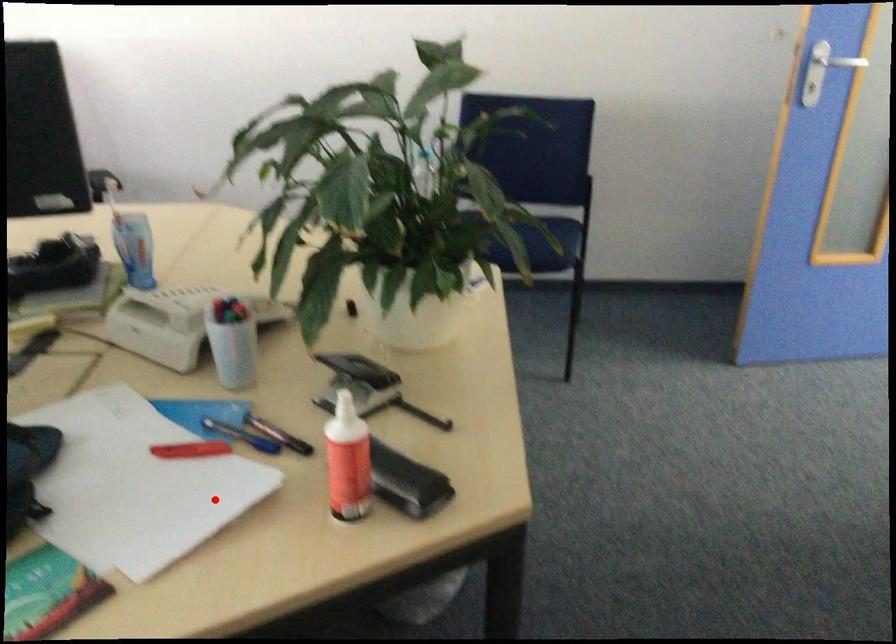
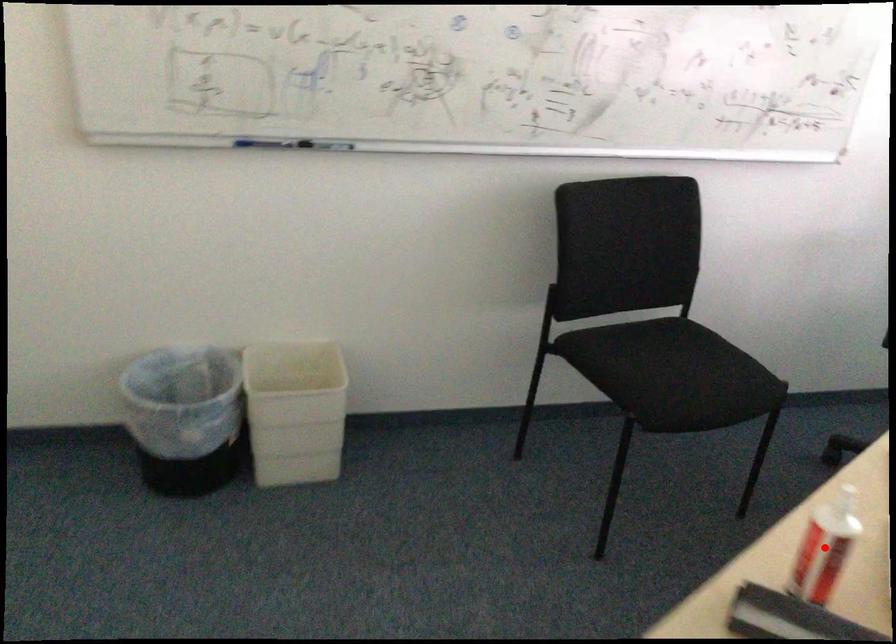
I am providing you with two images of the same scene from different viewpoints. A red point is marked on the first image and another point is marked on the second image. Is the red point in image1 aligned with the point shown in image2?

Yes